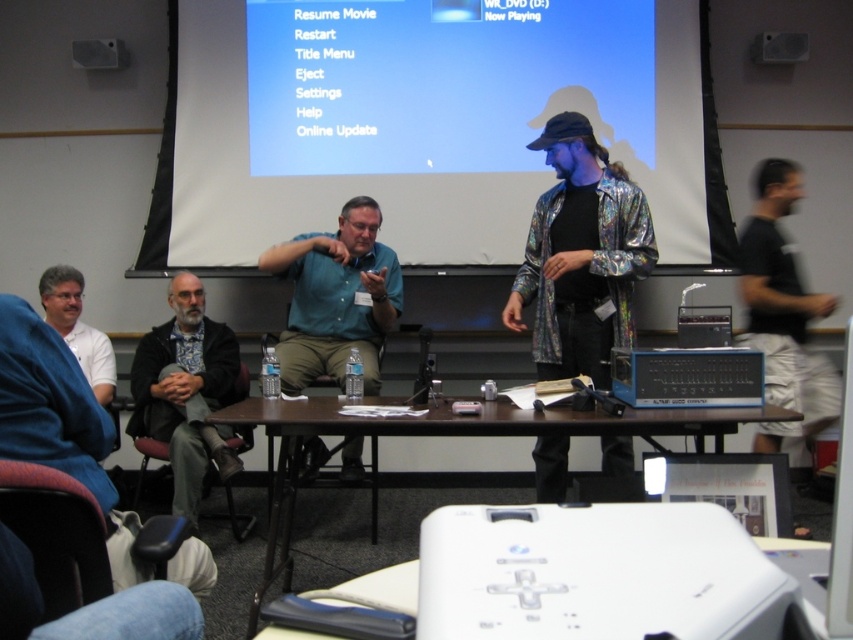
Based on the scene description, where is the white matte projection screen at upper center located in terms of its 2D coordinates?

The white matte projection screen at upper center is located at the 2D coordinates of point (x=433, y=125).

You are a photographer positioned behind the audience in the conference room. You want to take a photo of the shiny metallic jacket at center and the green matte shirt at center. Which one will be closer to the camera in the photo?

The shiny metallic jacket at center is in front of the green matte shirt at center, so it will be closer to the camera in the photo.

You are an attendee at the conference. You want to take a photo of the white matte projection screen at upper center without blocking the view of the person in black fabric shorts at right. Is the screen above or below the shorts?

The white matte projection screen at upper center is located above the black fabric shorts at right, so taking a photo from a lower angle might allow you to capture the screen without blocking the person below.